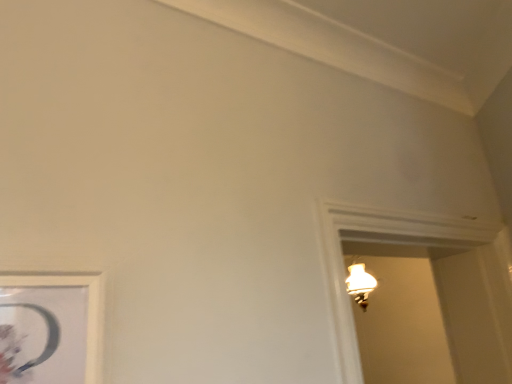
What do you see at coordinates (51, 329) in the screenshot?
I see `white matte picture frame at lower left` at bounding box center [51, 329].

This screenshot has width=512, height=384. I want to click on white matte picture frame at lower left, so click(51, 329).

The width and height of the screenshot is (512, 384). I want to click on white matte picture frame at lower left, so (x=51, y=329).